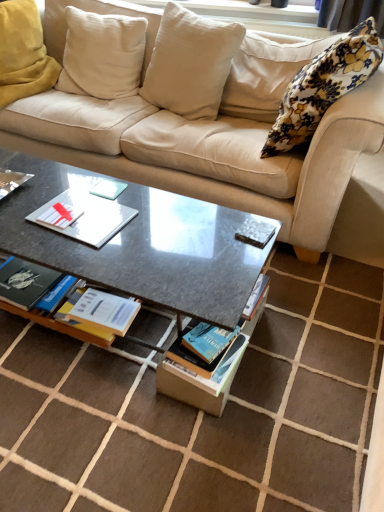
Question: Is hardcover book at center, which is the first book from bottom to top, bigger than blue matte book at center, which is the 1th magazine from bottom to top?

Choices:
 (A) yes
 (B) no

Answer: (B)

Question: Does hardcover book at center, which is the first book from bottom to top, have a greater height compared to blue matte book at center, which is the 1th magazine from bottom to top?

Choices:
 (A) no
 (B) yes

Answer: (A)

Question: From the image's perspective, is hardcover book at center, acting as the second book starting from the top, located beneath blue matte book at center, which is the 1th magazine from bottom to top?

Choices:
 (A) yes
 (B) no

Answer: (B)

Question: Is hardcover book at center, which is the first book from bottom to top, closer to camera compared to blue matte book at center, which is the 1th magazine from bottom to top?

Choices:
 (A) yes
 (B) no

Answer: (B)

Question: Does hardcover book at center, the first book positioned from the right, come behind blue matte book at center, which is the 1th magazine from bottom to top?

Choices:
 (A) yes
 (B) no

Answer: (A)

Question: In terms of width, does hardcover book at center, acting as the second book starting from the top, look wider or thinner when compared to beige fabric couch at upper center?

Choices:
 (A) thin
 (B) wide

Answer: (A)

Question: From the image's perspective, is hardcover book at center, the first book positioned from the right, positioned above or below beige fabric couch at upper center?

Choices:
 (A) below
 (B) above

Answer: (A)

Question: Is hardcover book at center, which is the first book from bottom to top, in front of or behind beige fabric couch at upper center in the image?

Choices:
 (A) front
 (B) behind

Answer: (B)

Question: In terms of height, does hardcover book at center, acting as the second book starting from the top, look taller or shorter compared to beige fabric couch at upper center?

Choices:
 (A) tall
 (B) short

Answer: (B)

Question: From the image's perspective, is metallic silver magazine at center, the 1th magazine viewed from the top, above or below beige cotton cushion at upper left, arranged as the 2th pillow when viewed from the left?

Choices:
 (A) above
 (B) below

Answer: (B)

Question: Do you think metallic silver magazine at center, the 1th magazine viewed from the top, is within beige cotton cushion at upper left, marked as the third pillow in a right-to-left arrangement, or outside of it?

Choices:
 (A) outside
 (B) inside

Answer: (A)

Question: Is metallic silver magazine at center, the 1th magazine viewed from the top, taller or shorter than beige cotton cushion at upper left, marked as the third pillow in a right-to-left arrangement?

Choices:
 (A) tall
 (B) short

Answer: (B)

Question: Is metallic silver magazine at center, the 1th magazine viewed from the top, in front of or behind beige cotton cushion at upper left, arranged as the 2th pillow when viewed from the left, in the image?

Choices:
 (A) behind
 (B) front

Answer: (B)

Question: From a real-world perspective, relative to soft white cushion at upper left, the first pillow when ordered from left to right, is blue matte book at center, which is the 1th magazine from bottom to top, vertically above or below?

Choices:
 (A) above
 (B) below

Answer: (B)

Question: Based on their positions, is blue matte book at center, placed as the 2th magazine when sorted from top to bottom, located to the left or right of soft white cushion at upper left, which is counted as the fourth pillow, starting from the right?

Choices:
 (A) left
 (B) right

Answer: (B)